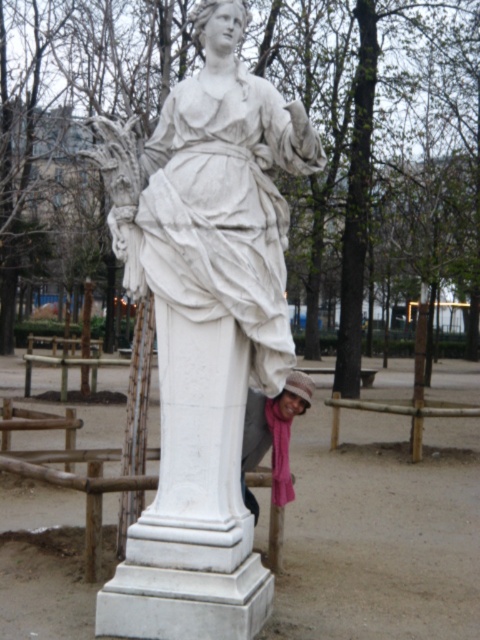
You are a photographer trying to capture both the white marble pillar at center and the pink fabric scarf at lower center in the same frame. Which object should you focus on first to ensure both are in the frame?

Since the white marble pillar at center is bigger than the pink fabric scarf at lower center, you should focus on the white marble pillar at center first to ensure both are in the frame.

You are standing in front of the statue and want to place a small flower bouquet between the two points, point (179, 314) and point (252, 449). Which point should you place the bouquet closer to so it appears larger in the photo?

You should place the bouquet closer to point (179, 314) because it is closer to the viewer than point (252, 449). Objects placed closer to the viewer appear larger in the photo.

You are a photographer trying to capture a photo of the white marble statue at center and the pink fabric scarf at lower center. Since you want both subjects to appear equally large in the photo, which object should you move closer to the camera?

To make both the white marble statue at center and the pink fabric scarf at lower center appear equally large in the photo, you should move the white marble statue at center closer to the camera because it is wider than the pink fabric scarf at lower center, so reducing its distance from the camera can help balance their sizes.